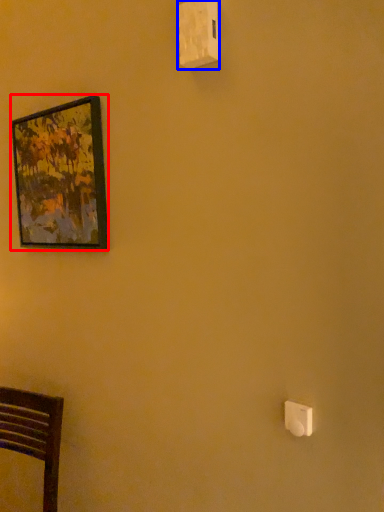
Question: Among these objects, which one is nearest to the camera, picture frame (highlighted by a red box) or light switch (highlighted by a blue box)?

Choices:
 (A) picture frame
 (B) light switch

Answer: (B)